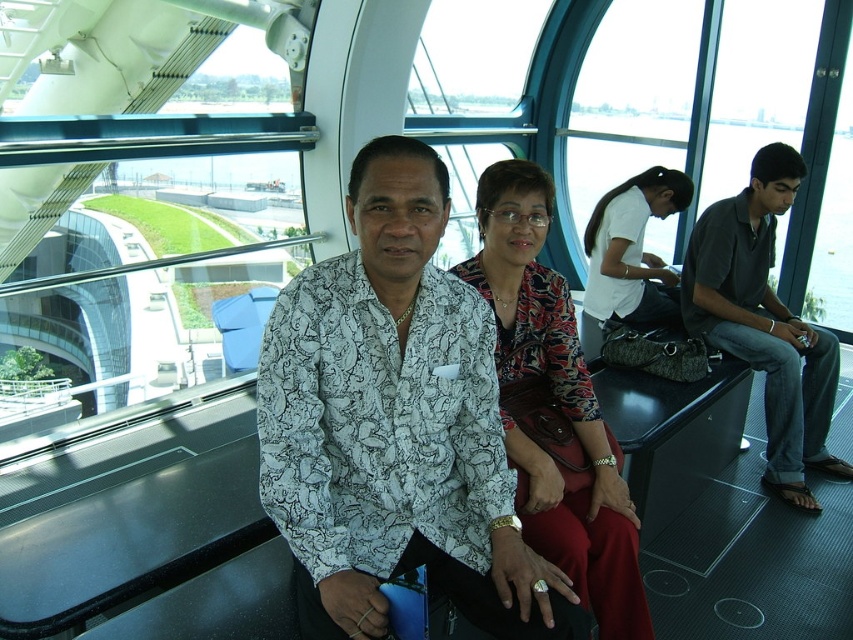
You are a tour guide in the cable car and want to hand out a brochure to both the printed fabric blouse at center and the white matte shirt at center. The brochures are placed on a shelf 1.5 meters away from you. Can you reach both passengers without moving from your current position?

The distance between the printed fabric blouse at center and white matte shirt at center is 1.62 meters. Since the brochures are 1.5 meters away from you, you can reach both passengers as the distance between them is greater than the distance to the brochures.